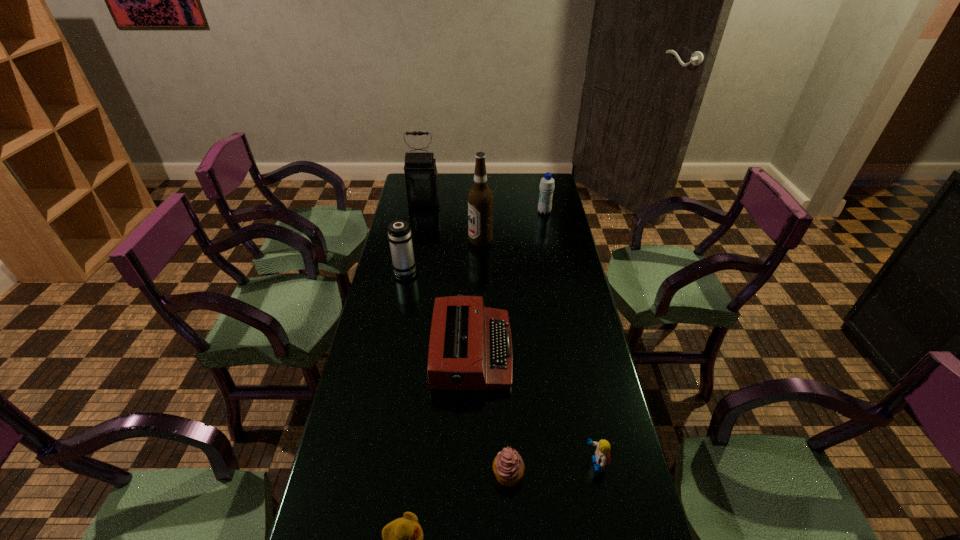
At what (x,y) coordinates should I click in order to perform the action: click on free location located on the label of the sixth nearest object. Please return your answer as a coordinate pair (x, y). Looking at the image, I should click on click(x=442, y=241).

The image size is (960, 540). I want to click on free spot located on the front-facing side of the lantern, so click(419, 231).

Where is `free space located on the side with the handle of the thermos bottle`? This screenshot has height=540, width=960. free space located on the side with the handle of the thermos bottle is located at coordinates (412, 236).

Where is `vacant space located 0.090m on the side with the handle of the thermos bottle`? vacant space located 0.090m on the side with the handle of the thermos bottle is located at coordinates (409, 246).

Where is `vacant region located on the side with the handle of the thermos bottle`? Image resolution: width=960 pixels, height=540 pixels. vacant region located on the side with the handle of the thermos bottle is located at coordinates (411, 239).

Where is `vacant area situated on the right of the water bottle`? The height and width of the screenshot is (540, 960). vacant area situated on the right of the water bottle is located at coordinates (564, 212).

Where is `blank area located 0.050m on the typing side of the typewriter`? blank area located 0.050m on the typing side of the typewriter is located at coordinates (527, 352).

Image resolution: width=960 pixels, height=540 pixels. Find the location of `free location located on the front-facing side of the Lego`. free location located on the front-facing side of the Lego is located at coordinates (541, 464).

The width and height of the screenshot is (960, 540). In order to click on free space located on the front-facing side of the Lego in this screenshot , I will do `click(498, 464)`.

I want to click on blank area located on the front-facing side of the Lego, so click(x=514, y=464).